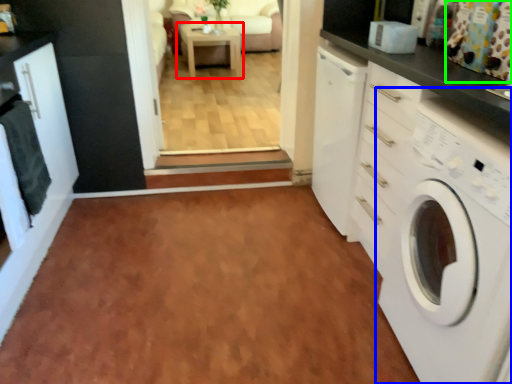
Question: Which is farther away from table (highlighted by a red box)? washing machine (highlighted by a blue box) or curtain (highlighted by a green box)?

Choices:
 (A) washing machine
 (B) curtain

Answer: (A)